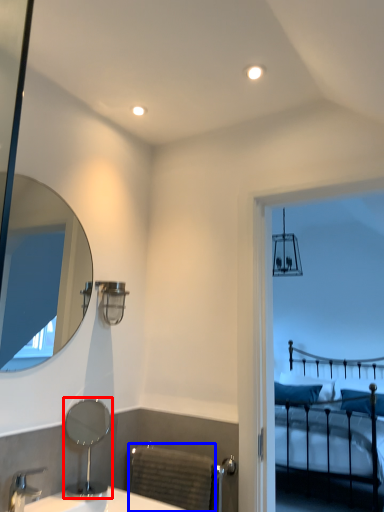
Question: Among these objects, which one is farthest to the camera, mirror (highlighted by a red box) or radiator (highlighted by a blue box)?

Choices:
 (A) mirror
 (B) radiator

Answer: (B)